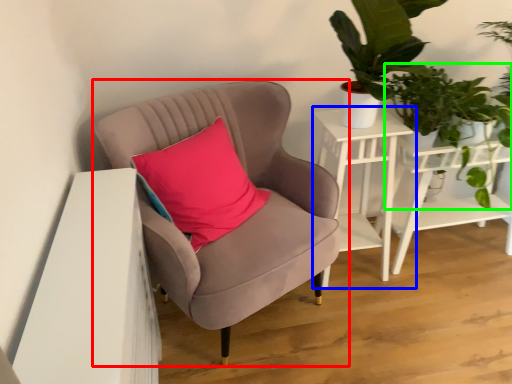
Question: Which object is positioned closest to chair (highlighted by a red box)? Select from table (highlighted by a blue box) and vegetation (highlighted by a green box).

Choices:
 (A) table
 (B) vegetation

Answer: (A)